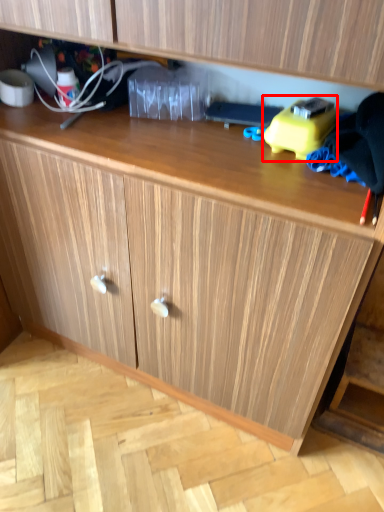
Question: In this image, where is toy (annotated by the red box) located relative to clothing?

Choices:
 (A) left
 (B) right

Answer: (A)